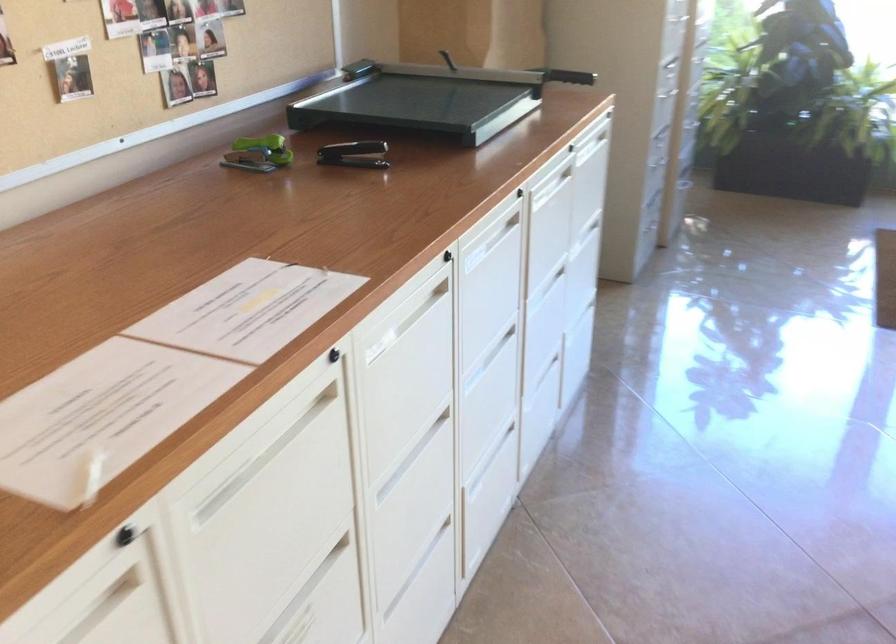
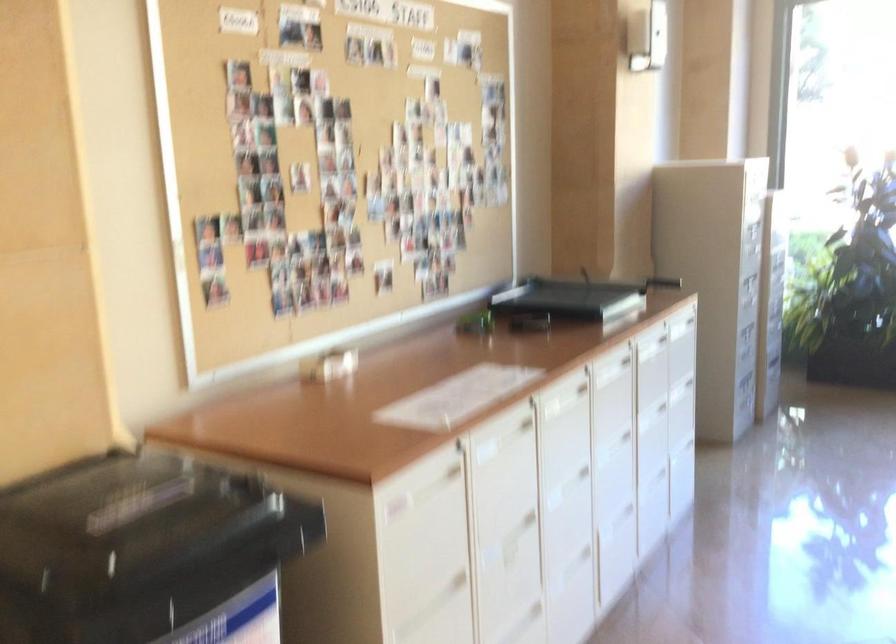
Find the pixel in the second image that matches point 271,489 in the first image.

(503, 465)